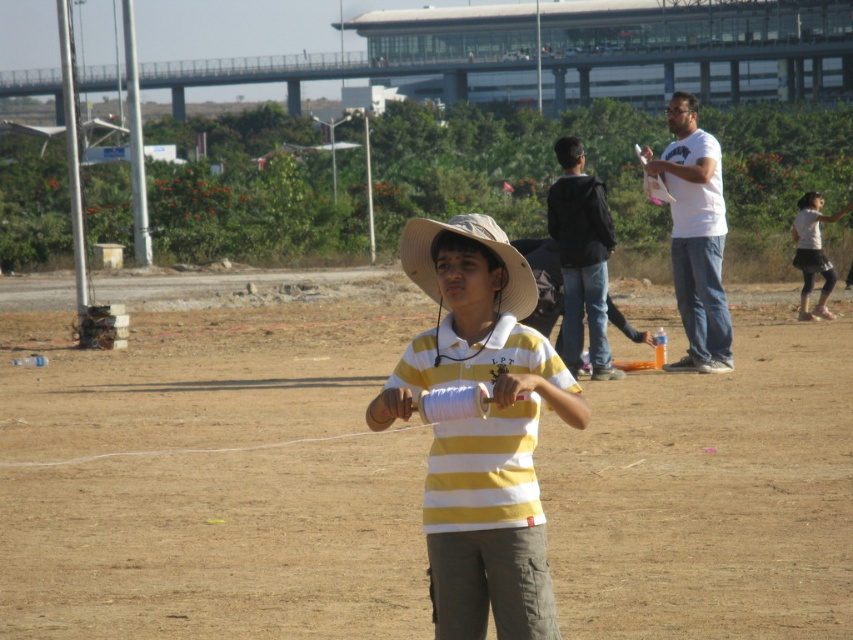
You are standing in the outdoor scene and want to walk from the brown dirt field at center to the white cotton shirt at right. Which direction should you move to get there?

To move from the brown dirt field at center to the white cotton shirt at right, you should move to your right since the white cotton shirt at right is positioned to the right of the brown dirt field at center.

You are a photographer trying to capture a wide shot of the brown dirt field at center and the white cotton shirt at right. Since you want both objects to be clearly visible in the frame, which one should you focus on to ensure proper depth of field?

The brown dirt field at center is larger in size than the white cotton shirt at right, so focusing on the brown dirt field at center will ensure both are in focus due to its larger size dominating the scene.